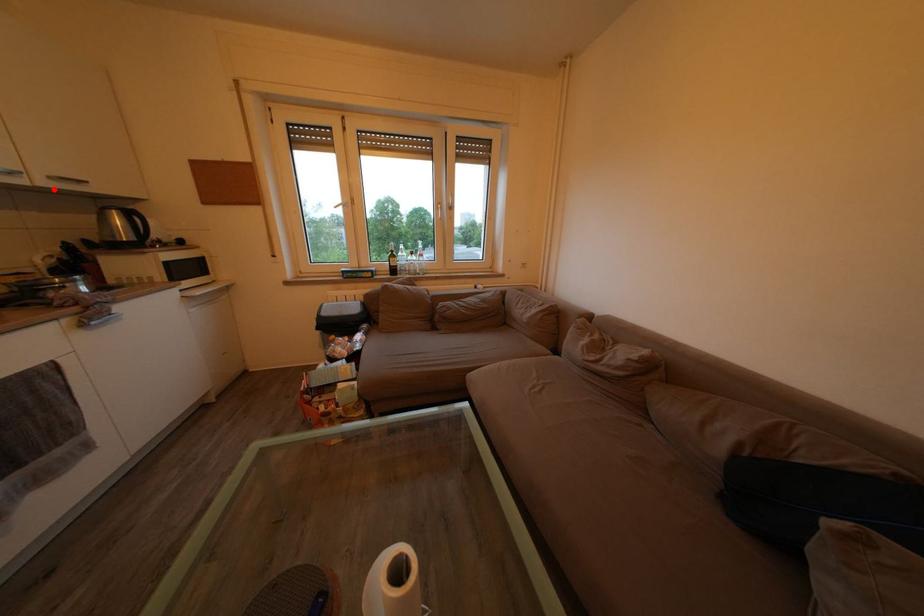
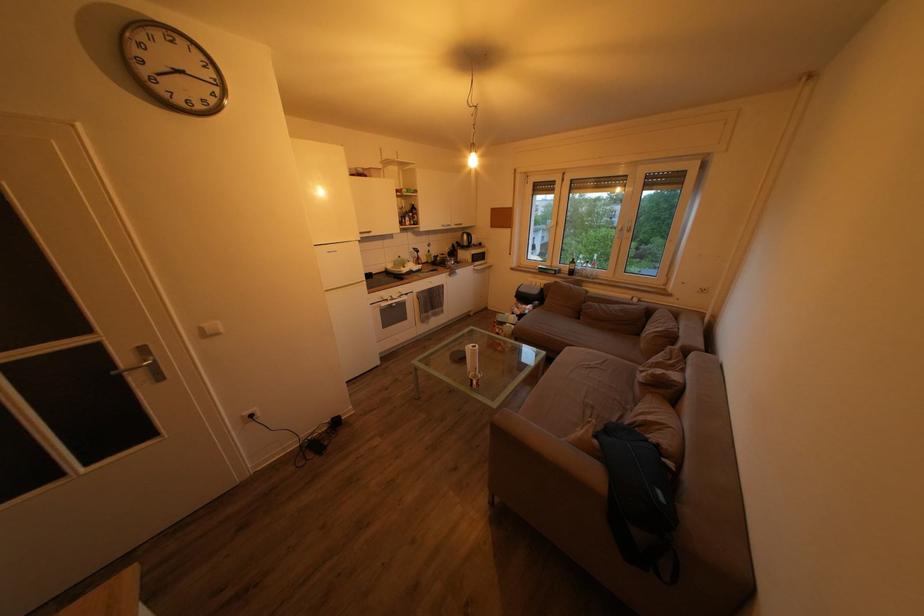
Question: I am providing you with two images of the same scene from different viewpoints. Given a red point in image1, look at the same physical point in image2. Is it:

Choices:
 (A) Closer to the viewpoint
 (B) Farther from the viewpoint

Answer: (A)